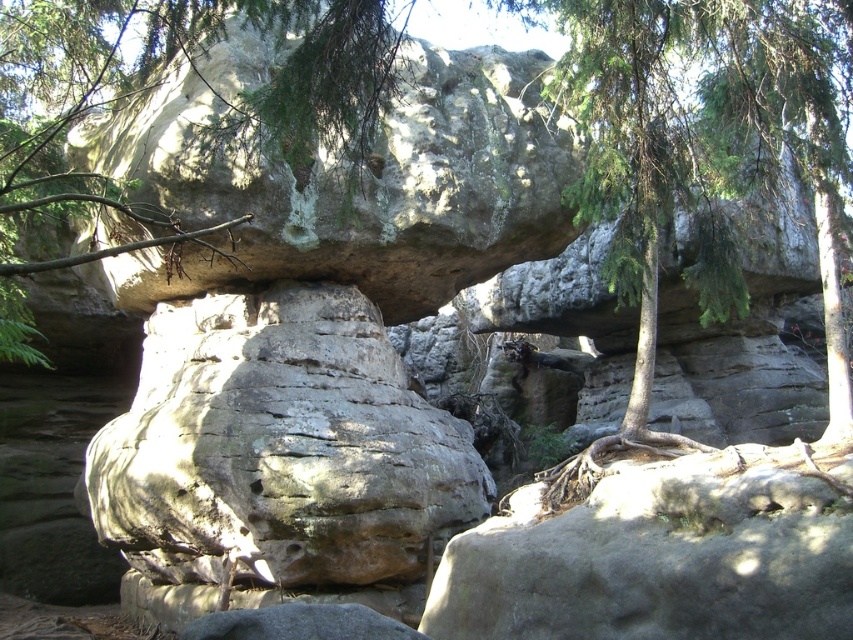
Can you confirm if rough textured rock at center is positioned to the right of green textured rock at upper center?

Yes, rough textured rock at center is to the right of green textured rock at upper center.

Can you confirm if rough textured rock at center is shorter than green textured rock at upper center?

Yes, rough textured rock at center is shorter than green textured rock at upper center.

Based on the photo, who is more distant from viewer, (216, 324) or (57, 88)?

The point (57, 88) is more distant.

The image size is (853, 640). Find the location of `rough textured rock at center`. rough textured rock at center is located at coordinates (280, 449).